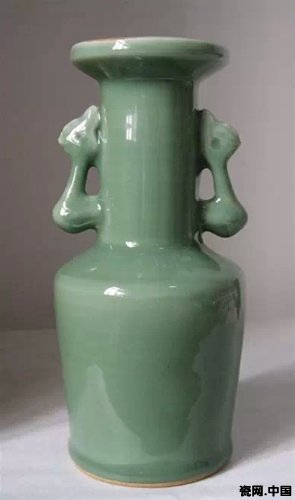
Where is `neck of vase`? neck of vase is located at coordinates (140, 150).